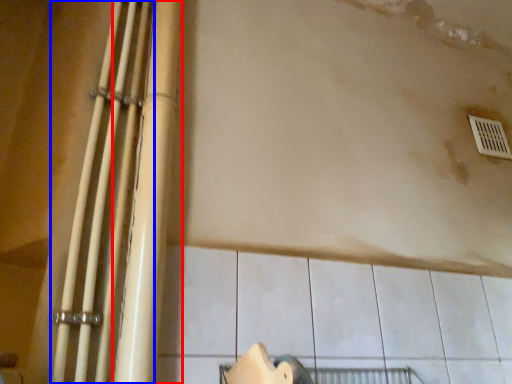
Question: Which object appears farthest to the camera in this image, beam (highlighted by a red box) or beam (highlighted by a blue box)?

Choices:
 (A) beam
 (B) beam

Answer: (A)